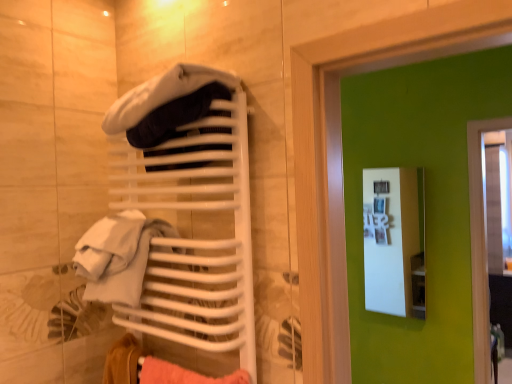
Question: Are white matte towel rack at upper left and velvety white hat at upper center far apart?

Choices:
 (A) yes
 (B) no

Answer: (B)

Question: Is white matte towel rack at upper left wider than velvety white hat at upper center?

Choices:
 (A) no
 (B) yes

Answer: (A)

Question: Can we say white matte towel rack at upper left lies outside velvety white hat at upper center?

Choices:
 (A) no
 (B) yes

Answer: (B)

Question: Is white matte towel rack at upper left facing towards velvety white hat at upper center?

Choices:
 (A) yes
 (B) no

Answer: (A)

Question: Can you confirm if white matte towel rack at upper left is thinner than velvety white hat at upper center?

Choices:
 (A) no
 (B) yes

Answer: (B)

Question: Is velvety white hat at upper center inside white matte towel rack at upper left?

Choices:
 (A) yes
 (B) no

Answer: (A)

Question: Are white matte towel rack at upper left and white glossy medicine cabinet at upper center located far from each other?

Choices:
 (A) no
 (B) yes

Answer: (B)

Question: Can you confirm if white matte towel rack at upper left is taller than white glossy medicine cabinet at upper center?

Choices:
 (A) yes
 (B) no

Answer: (B)

Question: From a real-world perspective, is white matte towel rack at upper left beneath white glossy medicine cabinet at upper center?

Choices:
 (A) yes
 (B) no

Answer: (B)

Question: From the image's perspective, is white matte towel rack at upper left above white glossy medicine cabinet at upper center?

Choices:
 (A) yes
 (B) no

Answer: (A)

Question: Is white matte towel rack at upper left at the right side of white glossy medicine cabinet at upper center?

Choices:
 (A) yes
 (B) no

Answer: (B)

Question: Does white matte towel rack at upper left come behind white glossy medicine cabinet at upper center?

Choices:
 (A) no
 (B) yes

Answer: (A)

Question: Can you confirm if velvety white hat at upper center is shorter than white matte towel rack at upper left?

Choices:
 (A) yes
 (B) no

Answer: (A)